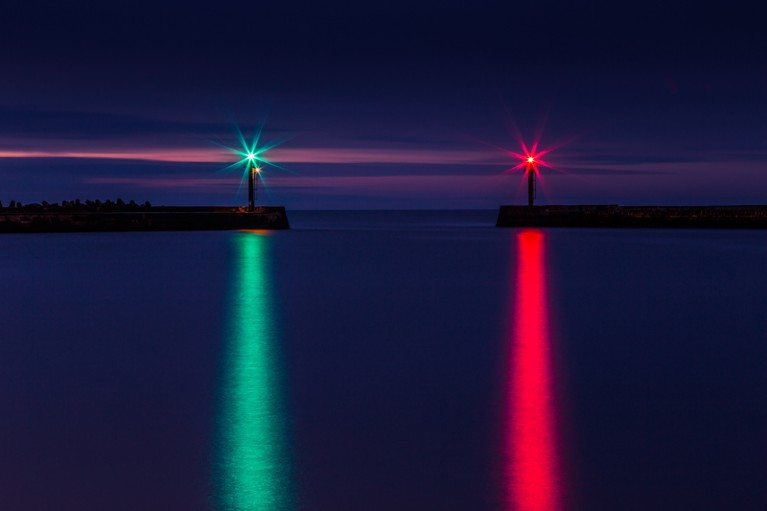
This screenshot has width=767, height=511. I want to click on green lighting, so pyautogui.click(x=251, y=153).